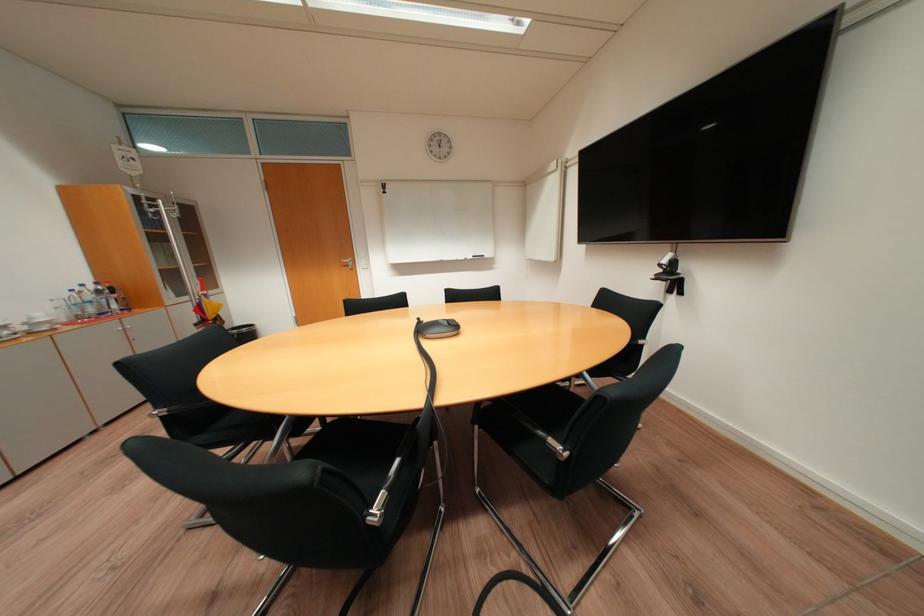
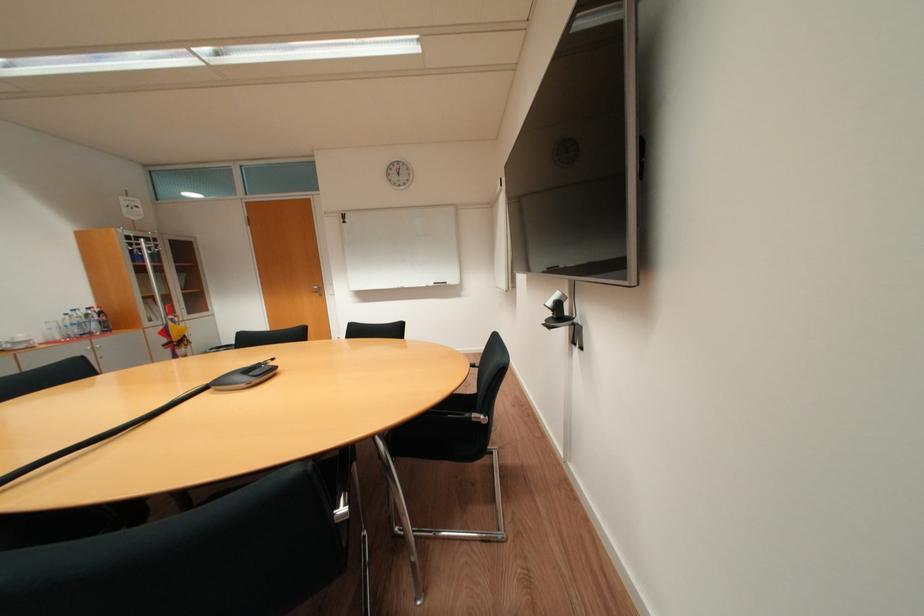
The point at (101, 288) is marked in the first image. Where is the corresponding point in the second image?

(92, 313)